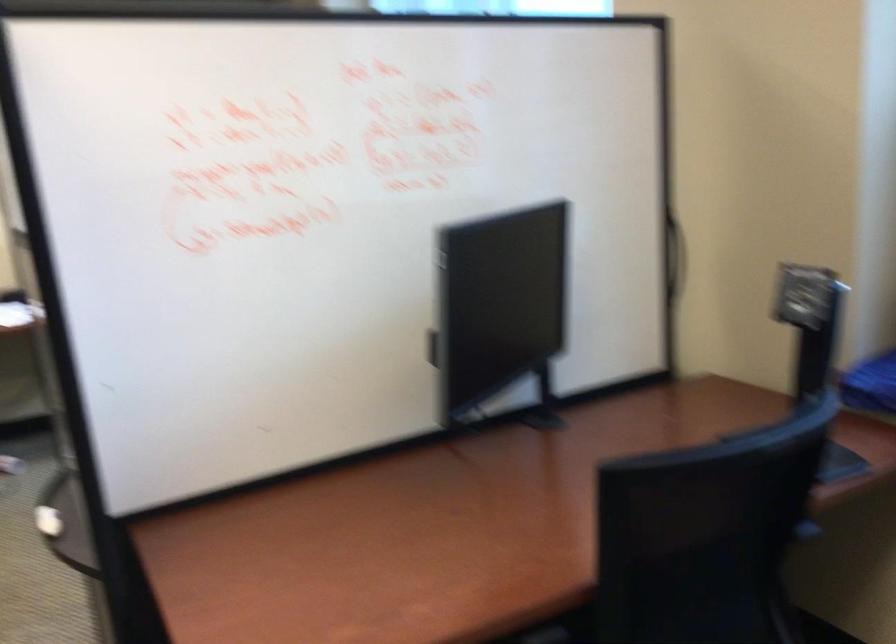
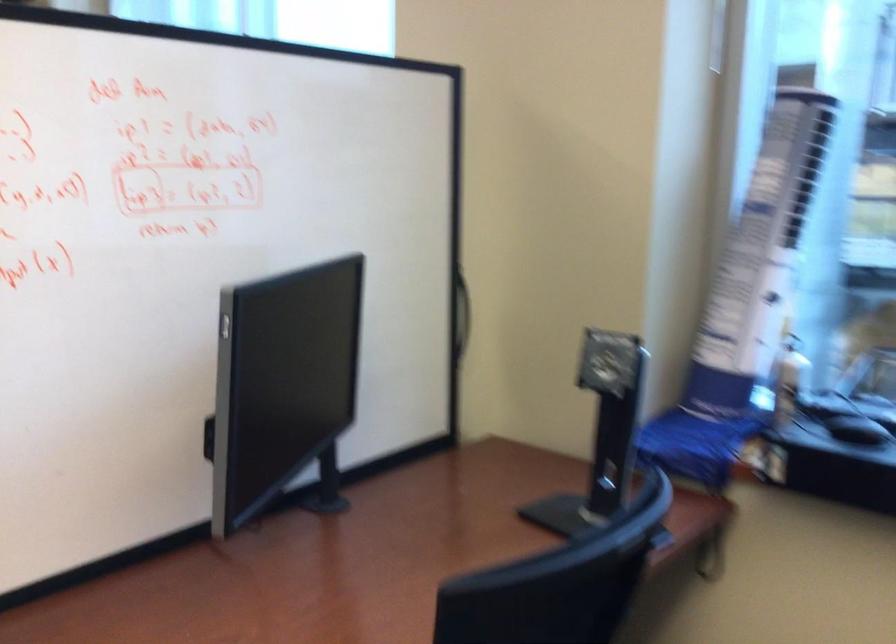
Find the pixel in the second image that matches the point at 538,410 in the first image.

(325, 487)